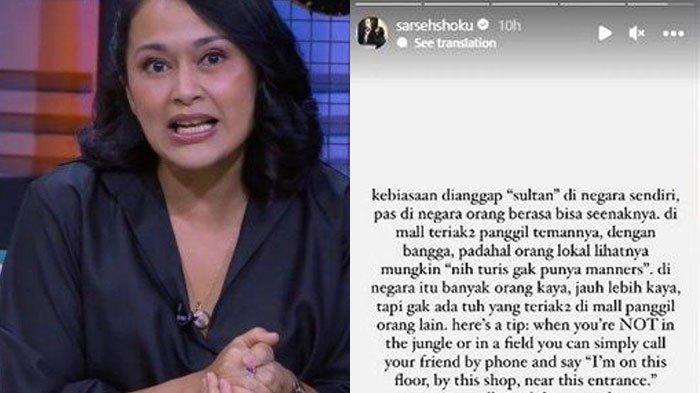
Find the location of `tv studio background`. tv studio background is located at coordinates (326, 53), (45, 76).